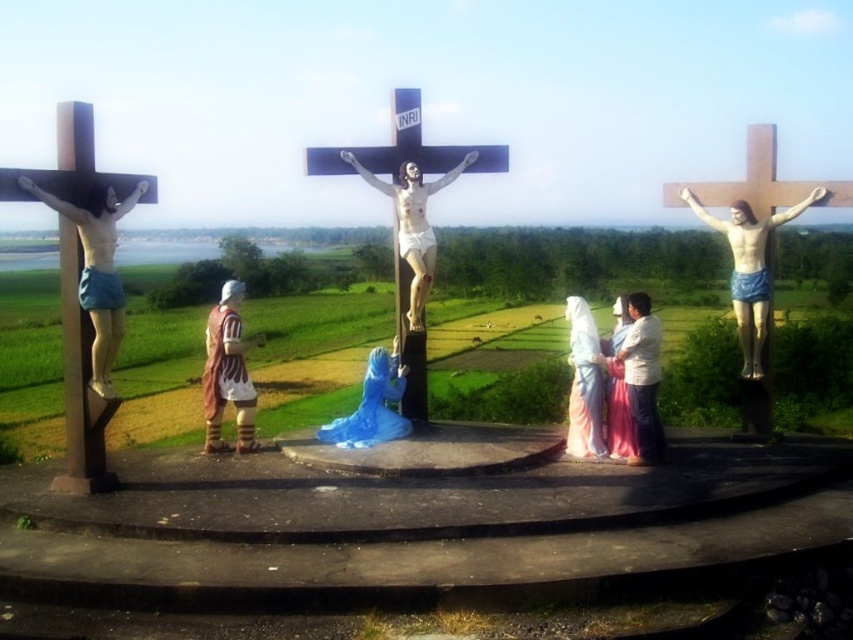
Question: Which point is farther to the camera?

Choices:
 (A) smooth pink fabric at center
 (B) white matte crucifix at center

Answer: (B)

Question: Which object appears closest to the camera in this image?

Choices:
 (A) matte white shirt at center
 (B) white matte crucifix at center
 (C) blue glossy statue at center

Answer: (A)

Question: Is brown wooden cross at left thinner than white matte crucifix at center?

Choices:
 (A) no
 (B) yes

Answer: (B)

Question: Can you confirm if matte blue shorts at left is positioned above blue glossy statue at center?

Choices:
 (A) yes
 (B) no

Answer: (A)

Question: Which point is closer to the camera taking this photo?

Choices:
 (A) (416, 177)
 (B) (85, 472)
 (C) (758, 262)

Answer: (B)

Question: Is brown wooden cross at left bigger than matte blue shorts at left?

Choices:
 (A) no
 (B) yes

Answer: (B)